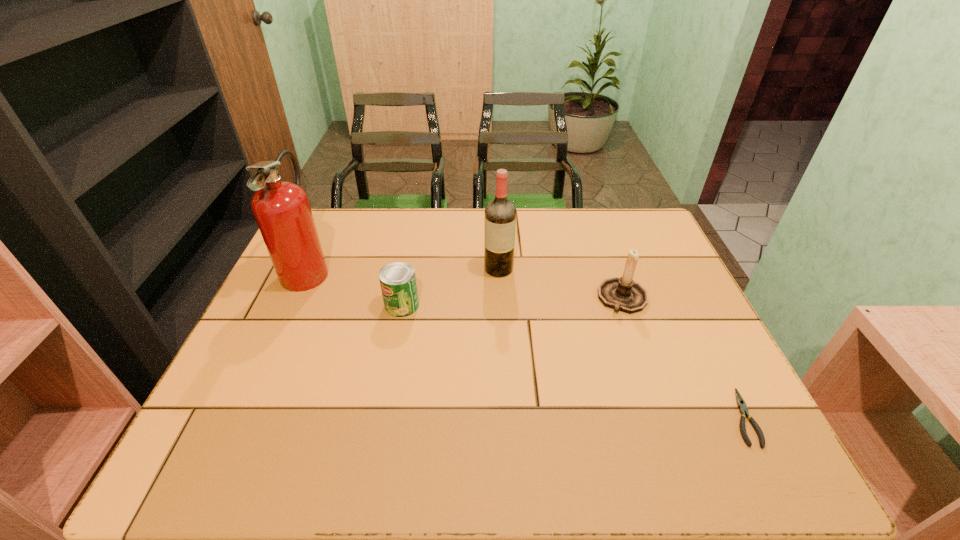
Locate an element on the screen. The height and width of the screenshot is (540, 960). vacant space located 0.230m with the handle and nozzle on the tallest object is located at coordinates (410, 269).

Where is `free spot located on the front-facing side of the fourth shortest object`? The image size is (960, 540). free spot located on the front-facing side of the fourth shortest object is located at coordinates (505, 388).

You are a GUI agent. You are given a task and a screenshot of the screen. Output one action in this format:
    pyautogui.click(x=<x>, y=<y>)
    Task: Click on the vacant space situated 0.400m on the front of the second object from right to left
    
    Given the screenshot: What is the action you would take?
    pyautogui.click(x=684, y=471)

In order to click on vacant space situated 0.090m on the front of the second shortest object in this screenshot , I will do `click(395, 344)`.

At what (x,y) coordinates should I click in order to perform the action: click on free point located on the back of the pliers. Please return your answer as a coordinate pair (x, y). Image resolution: width=960 pixels, height=540 pixels. Looking at the image, I should click on (680, 293).

Where is `object positioned at the far edge`? object positioned at the far edge is located at coordinates (282, 210).

Locate an element on the screen. This screenshot has height=540, width=960. object present at the near edge is located at coordinates (743, 410).

At what (x,y) coordinates should I click in order to perform the action: click on object that is at the left edge. Please return your answer as a coordinate pair (x, y). This screenshot has width=960, height=540. Looking at the image, I should click on (282, 210).

I want to click on candle holder that is at the right edge, so click(622, 294).

Find the location of `pliers present at the right edge`. pliers present at the right edge is located at coordinates (743, 410).